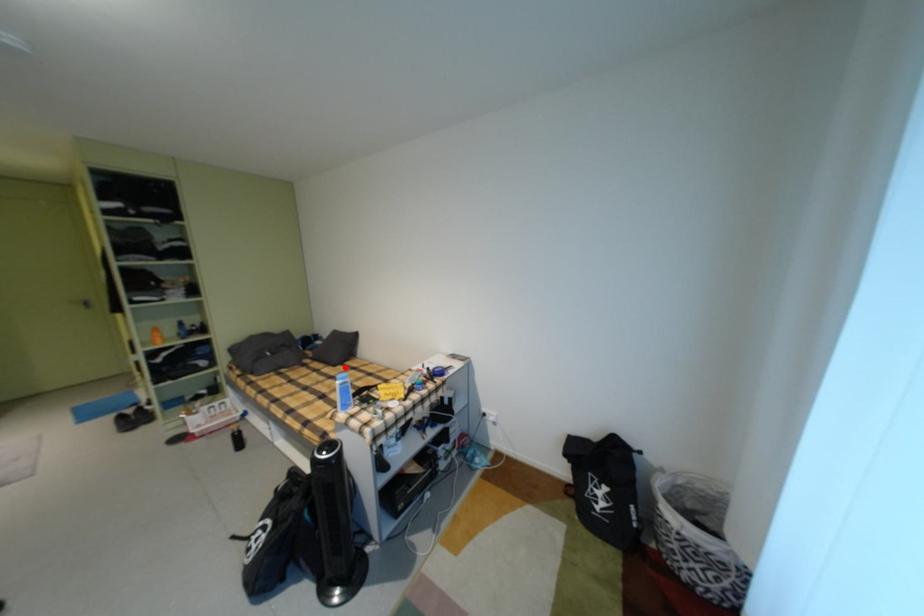
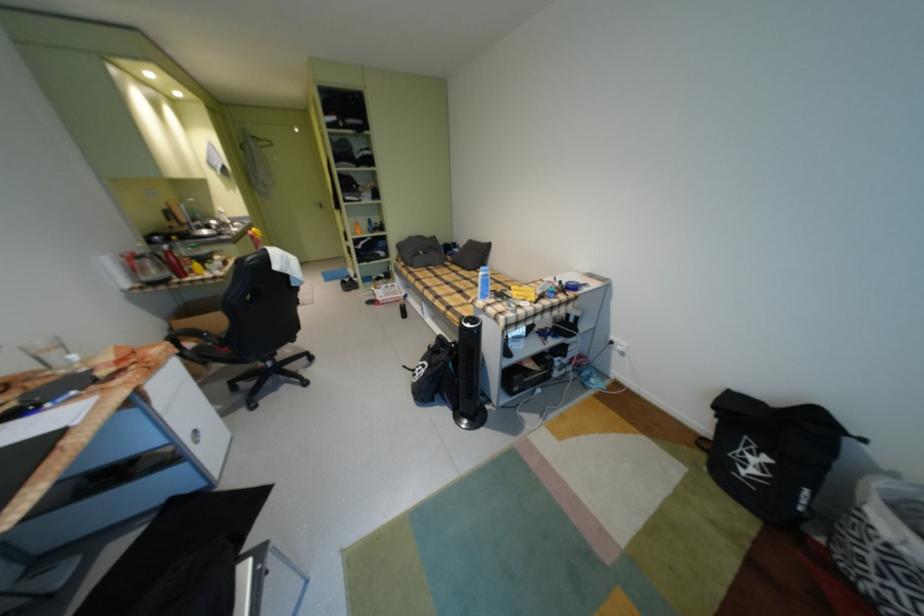
Question: I am providing you with two images of the same scene from different viewpoints. Given a red point in image1, look at the same physical point in image2. Is it:

Choices:
 (A) Closer to the viewpoint
 (B) Farther from the viewpoint

Answer: (A)